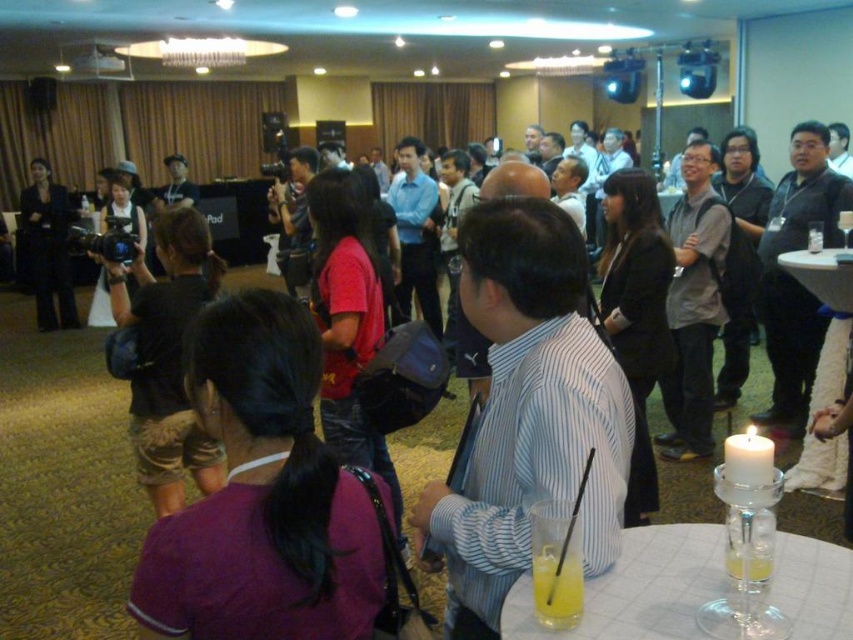
Which is more to the left, striped cotton shirt at center or clear glass candle at lower right?

striped cotton shirt at center

Which of these two, striped cotton shirt at center or clear glass candle at lower right, stands shorter?

With less height is clear glass candle at lower right.

Is point (496, 200) farther from camera compared to point (767, 612)?

Yes, point (496, 200) is farther from viewer.

Image resolution: width=853 pixels, height=640 pixels. Find the location of `striped cotton shirt at center`. striped cotton shirt at center is located at coordinates (527, 412).

Image resolution: width=853 pixels, height=640 pixels. Describe the element at coordinates (167, 356) in the screenshot. I see `black fabric camera at center` at that location.

Which is in front, point (180, 410) or point (822, 264)?

Point (180, 410) is in front.

The width and height of the screenshot is (853, 640). What are the coordinates of `black fabric camera at center` in the screenshot? It's located at (167, 356).

Based on the photo, is matte black suit at left positioned at the back of yellow translucent glass at lower center?

Yes, matte black suit at left is behind yellow translucent glass at lower center.

Image resolution: width=853 pixels, height=640 pixels. I want to click on matte black suit at left, so click(x=48, y=246).

Where is `matte black suit at left`? matte black suit at left is located at coordinates (48, 246).

Where is `matte black suit at left`? Image resolution: width=853 pixels, height=640 pixels. matte black suit at left is located at coordinates (48, 246).